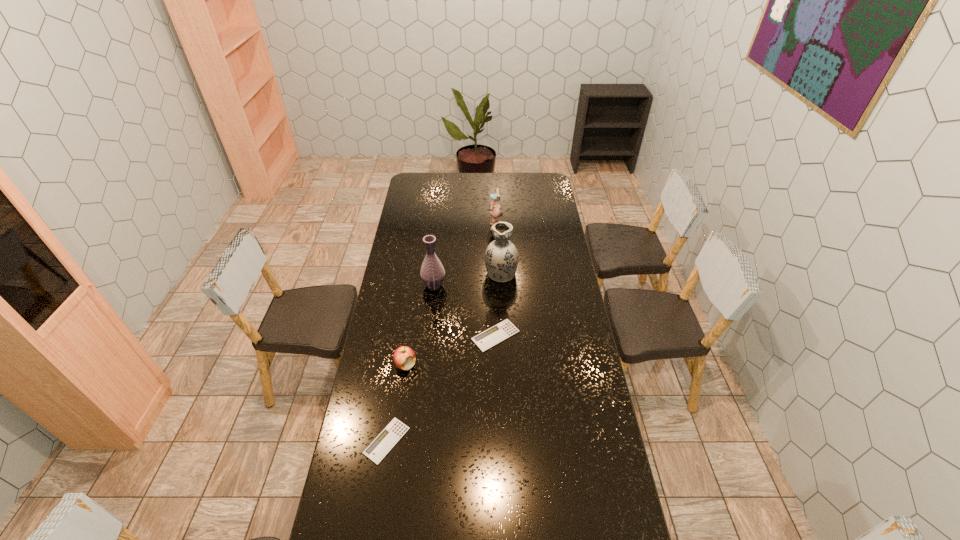
Please point a free position for a calculator on the right. Please provide its 2D coordinates. Your answer should be formatted as a tuple, i.e. [(x, y)], where the tuple contains the x and y coordinates of a point satisfying the conditions above.

[(570, 262)]